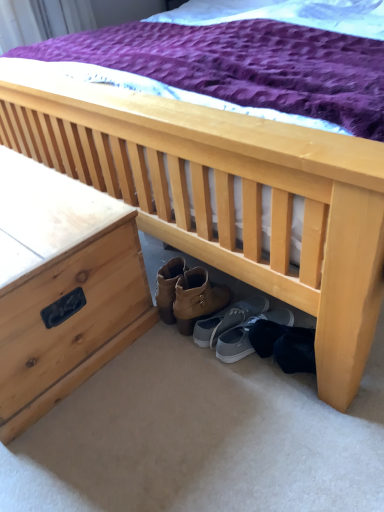
Question: Can you confirm if gray suede shoes at center, the second footwear from the right, is smaller than gray fabric shoe at lower center, which is the 1th footwear from right to left?

Choices:
 (A) no
 (B) yes

Answer: (B)

Question: Can we say gray suede shoes at center, the second footwear from the right, lies outside gray fabric shoe at lower center, which is the second footwear in left-to-right order?

Choices:
 (A) no
 (B) yes

Answer: (B)

Question: Is the position of gray suede shoes at center, the second footwear from the right, more distant than that of gray fabric shoe at lower center, which is the 1th footwear from right to left?

Choices:
 (A) no
 (B) yes

Answer: (B)

Question: Is gray suede shoes at center, the second footwear from the right, not near gray fabric shoe at lower center, which is the second footwear in left-to-right order?

Choices:
 (A) yes
 (B) no

Answer: (B)

Question: Is gray suede shoes at center, the first footwear when ordered from left to right, thinner than gray fabric shoe at lower center, which is the second footwear in left-to-right order?

Choices:
 (A) no
 (B) yes

Answer: (B)

Question: Would you say gray fabric shoe at lower center, which is the 1th footwear from right to left, is part of gray suede shoes at center, the first footwear when ordered from left to right,'s contents?

Choices:
 (A) yes
 (B) no

Answer: (B)

Question: Is gray suede shoes at center, the first footwear when ordered from left to right, further to camera compared to natural wood nightstand at left?

Choices:
 (A) no
 (B) yes

Answer: (B)

Question: Is gray suede shoes at center, the second footwear from the right, positioned with its back to natural wood nightstand at left?

Choices:
 (A) yes
 (B) no

Answer: (B)

Question: Can you confirm if gray suede shoes at center, the first footwear when ordered from left to right, is wider than natural wood nightstand at left?

Choices:
 (A) yes
 (B) no

Answer: (B)

Question: From the image's perspective, is gray suede shoes at center, the second footwear from the right, over natural wood nightstand at left?

Choices:
 (A) yes
 (B) no

Answer: (B)

Question: Considering the relative sizes of gray suede shoes at center, the second footwear from the right, and natural wood nightstand at left in the image provided, is gray suede shoes at center, the second footwear from the right, taller than natural wood nightstand at left?

Choices:
 (A) no
 (B) yes

Answer: (A)

Question: Considering the relative positions of gray suede shoes at center, the first footwear when ordered from left to right, and natural wood nightstand at left in the image provided, is gray suede shoes at center, the first footwear when ordered from left to right, to the left of natural wood nightstand at left from the viewer's perspective?

Choices:
 (A) yes
 (B) no

Answer: (B)

Question: Can you confirm if natural wood nightstand at left is thinner than gray suede shoes at center, the first footwear when ordered from left to right?

Choices:
 (A) no
 (B) yes

Answer: (A)